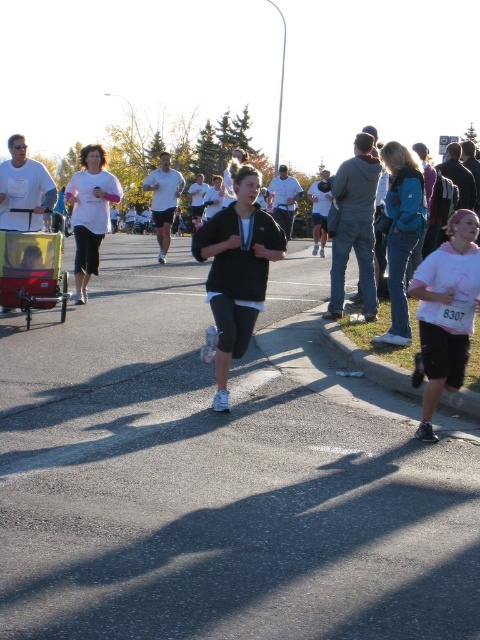
Does black cotton shirt at center have a smaller size compared to black matte running shoes at center?

Actually, black cotton shirt at center might be larger than black matte running shoes at center.

Can you confirm if black cotton shirt at center is wider than black matte running shoes at center?

Indeed, black cotton shirt at center has a greater width compared to black matte running shoes at center.

Locate an element on the screen. black cotton shirt at center is located at coordinates (165, 355).

What are the coordinates of `black cotton shirt at center` in the screenshot? It's located at (165, 355).

Who is more distant from viewer, (266, 323) or (31, 244)?

The point (266, 323) is more distant.

The width and height of the screenshot is (480, 640). Identify the location of black cotton shirt at center. (165, 355).

Which is behind, point (236, 330) or point (116, 186)?

Point (116, 186)

Does black matte running shoes at center have a greater height compared to white cotton shirt at center?

In fact, black matte running shoes at center may be shorter than white cotton shirt at center.

At what (x,y) coordinates should I click in order to perform the action: click on black matte running shoes at center. Please return your answer as a coordinate pair (x, y). Image resolution: width=480 pixels, height=640 pixels. Looking at the image, I should click on (236, 273).

Locate an element on the screen. The image size is (480, 640). black matte running shoes at center is located at coordinates (236, 273).